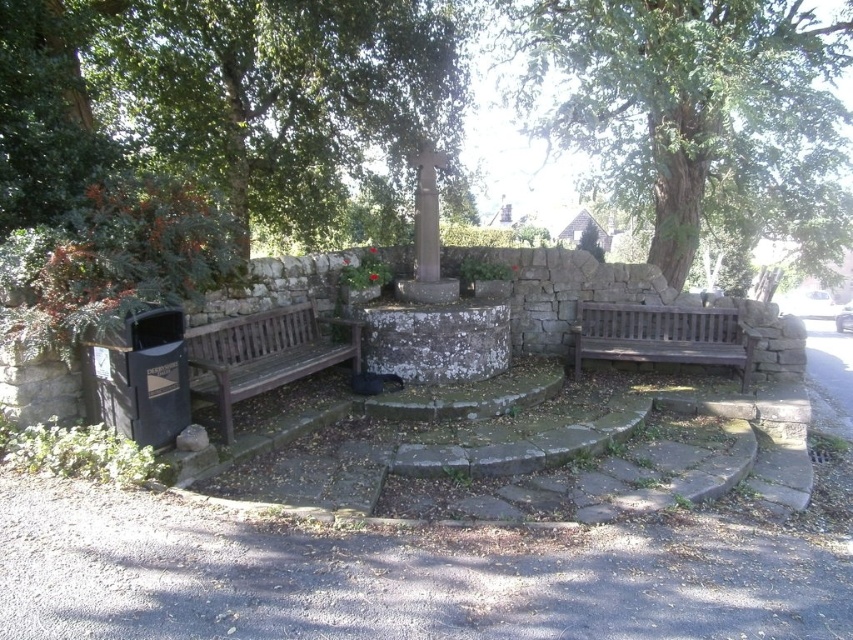
Question: Does green leafy tree at upper center have a greater width compared to brown wooden bench at right?

Choices:
 (A) yes
 (B) no

Answer: (A)

Question: Can you confirm if wooden bench at left is positioned above smooth stone pillar at center?

Choices:
 (A) no
 (B) yes

Answer: (A)

Question: Which of the following is the closest to the observer?

Choices:
 (A) brown wooden bench at right
 (B) green leafy tree at upper right
 (C) green leafy tree at upper center
 (D) smooth stone pillar at center

Answer: (C)

Question: Which point is farther from the camera taking this photo?

Choices:
 (A) (422, 188)
 (B) (204, 22)
 (C) (589, 330)
 (D) (573, 10)

Answer: (C)

Question: Which point is farther to the camera?

Choices:
 (A) (190, 125)
 (B) (531, 45)

Answer: (B)

Question: Is brown wooden bench at right behind smooth stone pillar at center?

Choices:
 (A) no
 (B) yes

Answer: (A)